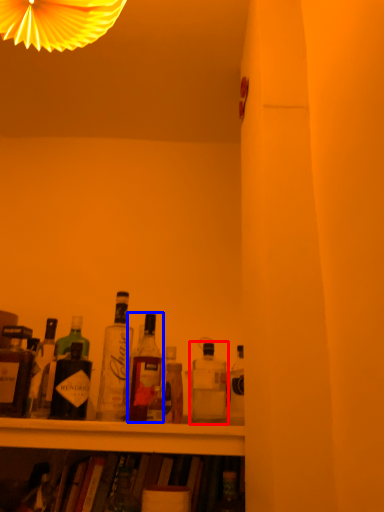
Question: Which point is further to the camera, bottle (highlighted by a red box) or bottle (highlighted by a blue box)?

Choices:
 (A) bottle
 (B) bottle

Answer: (B)